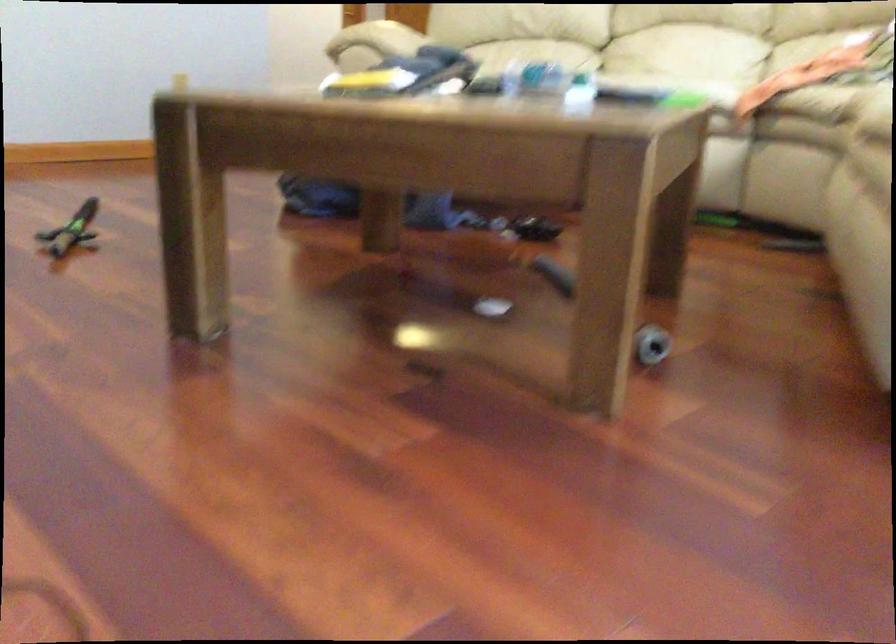
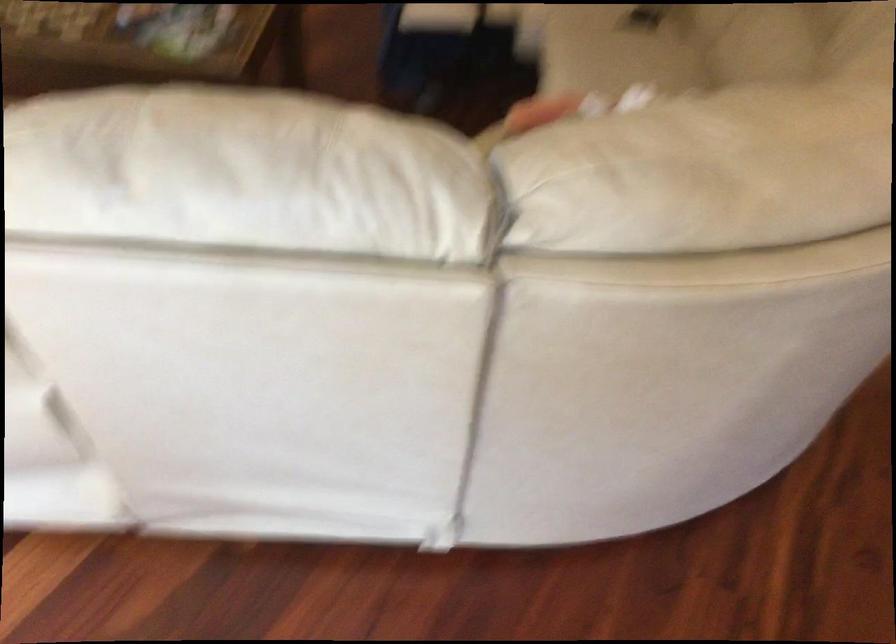
The point at (659, 79) is marked in the first image. Where is the corresponding point in the second image?

(616, 49)